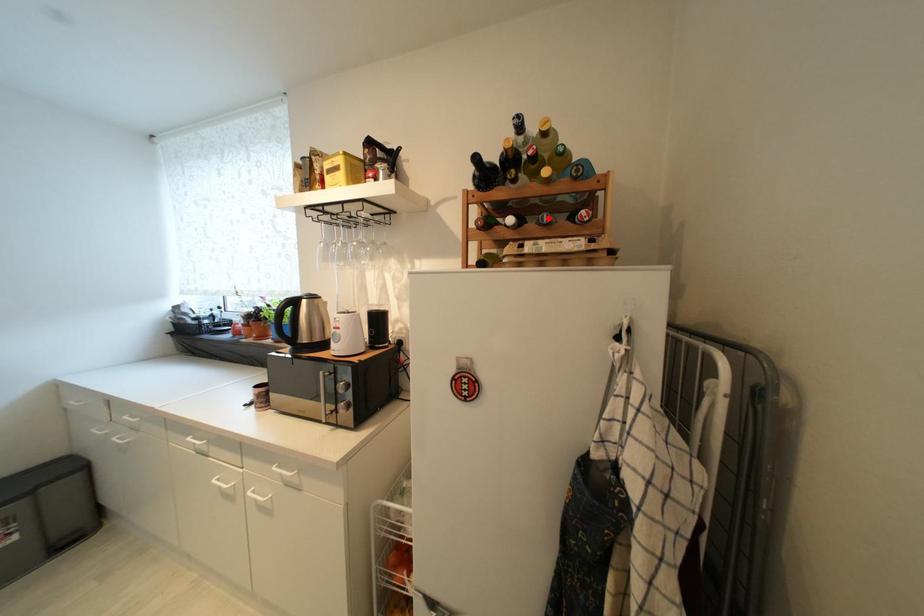
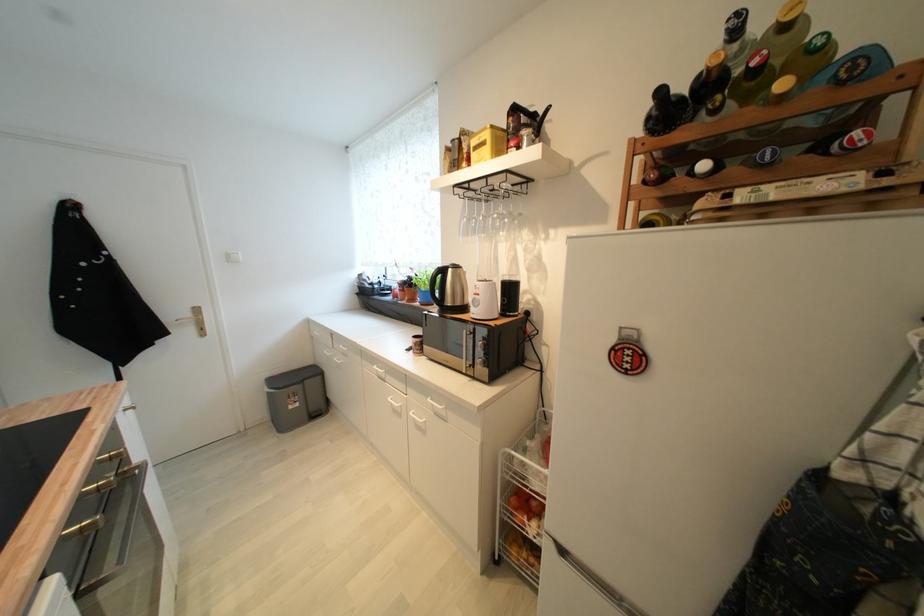
Question: I am providing you with two images of the same scene from different viewpoints. In image1, a red point is highlighted. Considering the same 3D point in image2, which of the following is correct?

Choices:
 (A) It is closer
 (B) It is farther

Answer: (B)